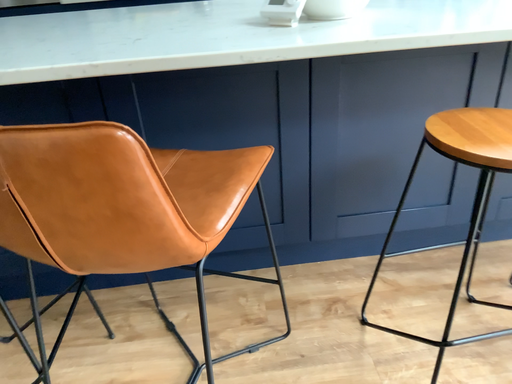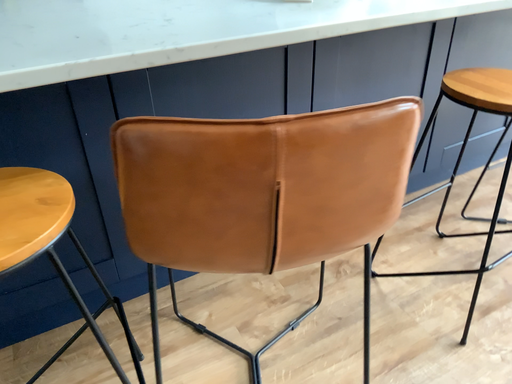
Question: Which way did the camera rotate in the video?

Choices:
 (A) rotated right
 (B) rotated left

Answer: (A)